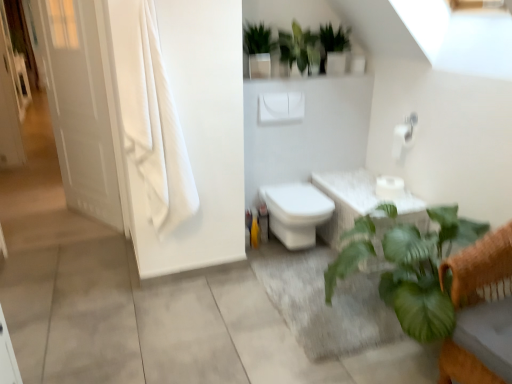
The width and height of the screenshot is (512, 384). Identify the location of vacant area that is in front of white matte toilet paper at center, the first toilet paper ordered from the bottom. (403, 202).